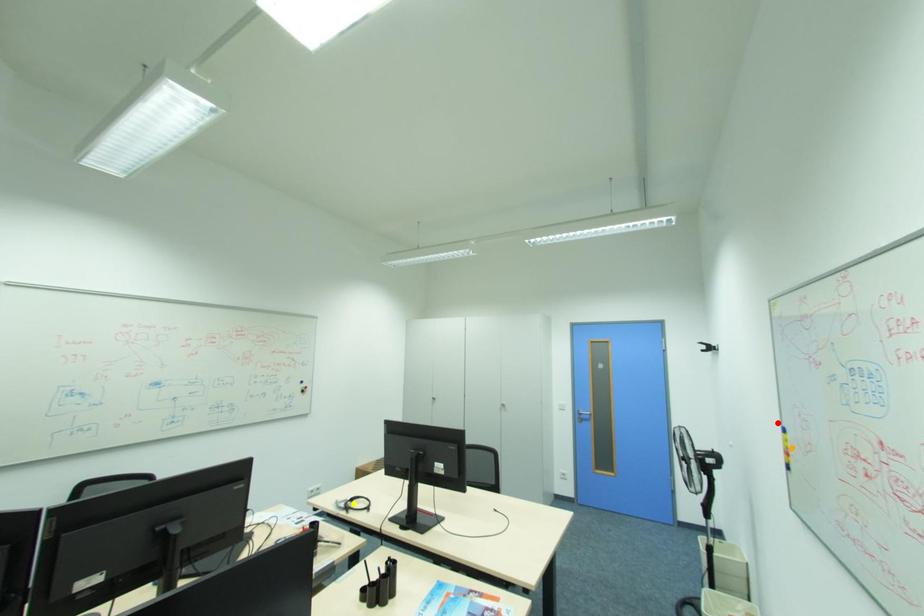
Order these from nearest to farthest:
red point | yellow point | orange point

yellow point → red point → orange point